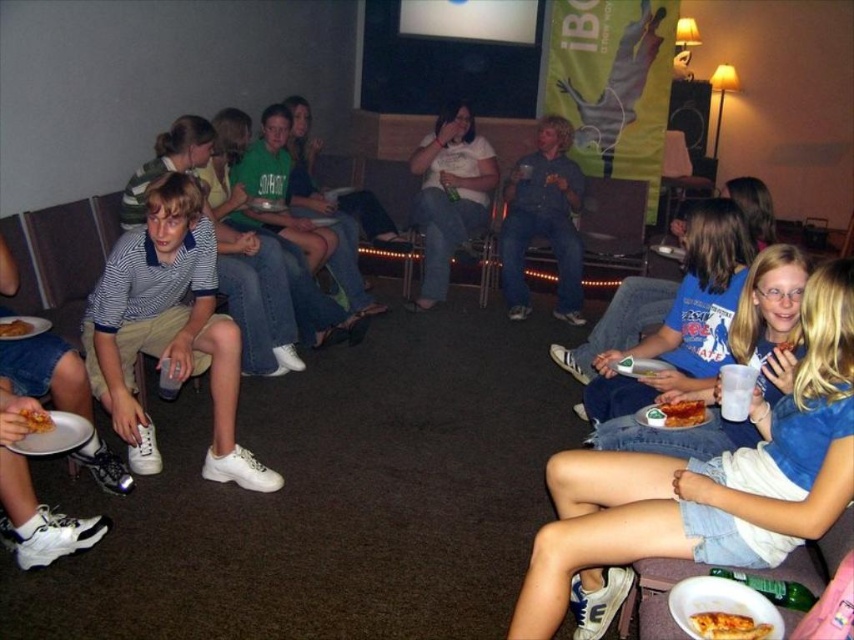
Can you confirm if golden crispy pizza slice at lower right is positioned below tomato sauce pizza at lower right?

Yes.

Can you confirm if golden crispy pizza slice at lower right is wider than tomato sauce pizza at lower right?

Indeed, golden crispy pizza slice at lower right has a greater width compared to tomato sauce pizza at lower right.

Is point (734, 616) closer to viewer compared to point (682, 400)?

Yes.

Image resolution: width=854 pixels, height=640 pixels. What are the coordinates of `golden crispy pizza slice at lower right` in the screenshot? It's located at (727, 627).

Is white matte shirt at center below golden crispy chicken at lower left?

No.

Which is more to the right, white matte shirt at center or golden crispy chicken at lower left?

From the viewer's perspective, white matte shirt at center appears more on the right side.

Which is in front, point (442, 147) or point (51, 428)?

Point (51, 428) is more forward.

I want to click on white matte shirt at center, so click(x=449, y=195).

Does white matte shirt at center have a greater height compared to tomato sauce pizza at lower right?

Correct, white matte shirt at center is much taller as tomato sauce pizza at lower right.

Does point (436, 289) come in front of point (685, 403)?

No, (436, 289) is behind (685, 403).

Between point (466, 240) and point (677, 406), which one is positioned behind?

Point (466, 240)

You are a GUI agent. You are given a task and a screenshot of the screen. Output one action in this format:
    pyautogui.click(x=<x>, y=<y>)
    Task: Click on the white matte shirt at center
    The image size is (854, 640).
    Given the screenshot: What is the action you would take?
    pyautogui.click(x=449, y=195)